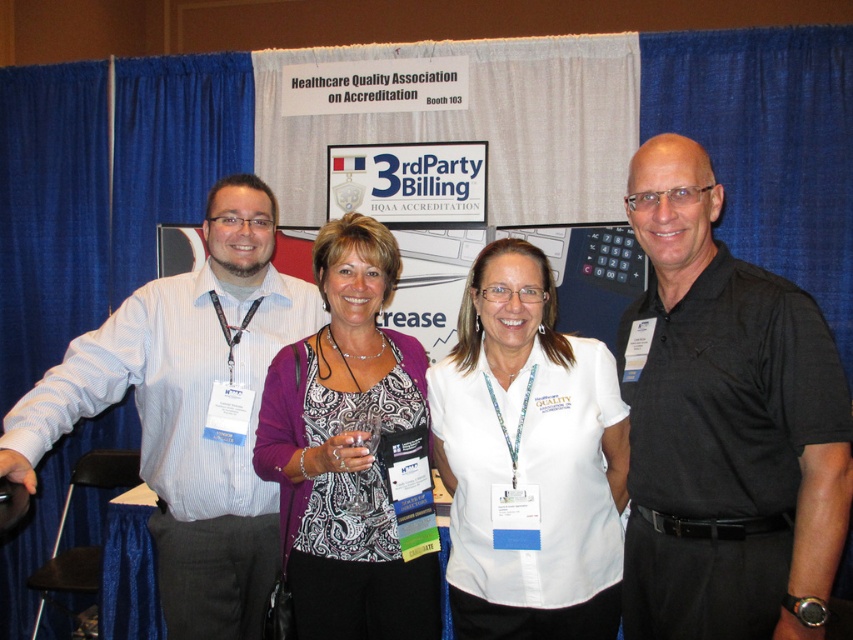
Which is in front, point (527, 481) or point (368, 252)?

Point (527, 481) is more forward.

Is point (604, 524) positioned behind point (357, 308)?

No, it is in front of (357, 308).

In order to click on white fabric shirt at center in this screenshot , I will do `click(527, 460)`.

Is white striped shirt at center taller than white fabric shirt at center?

Yes, white striped shirt at center is taller than white fabric shirt at center.

Between white striped shirt at center and white fabric shirt at center, which one has more height?

white striped shirt at center is taller.

Who is more forward, (221,536) or (572,490)?

Point (572,490) is in front.

Locate an element on the screen. This screenshot has height=640, width=853. white striped shirt at center is located at coordinates (189, 410).

Is point (805, 445) farther from viewer compared to point (360, 448)?

No.

What do you see at coordinates (724, 424) in the screenshot? The height and width of the screenshot is (640, 853). I see `black shirt at right` at bounding box center [724, 424].

Identify the location of black shirt at right. This screenshot has height=640, width=853. (724, 424).